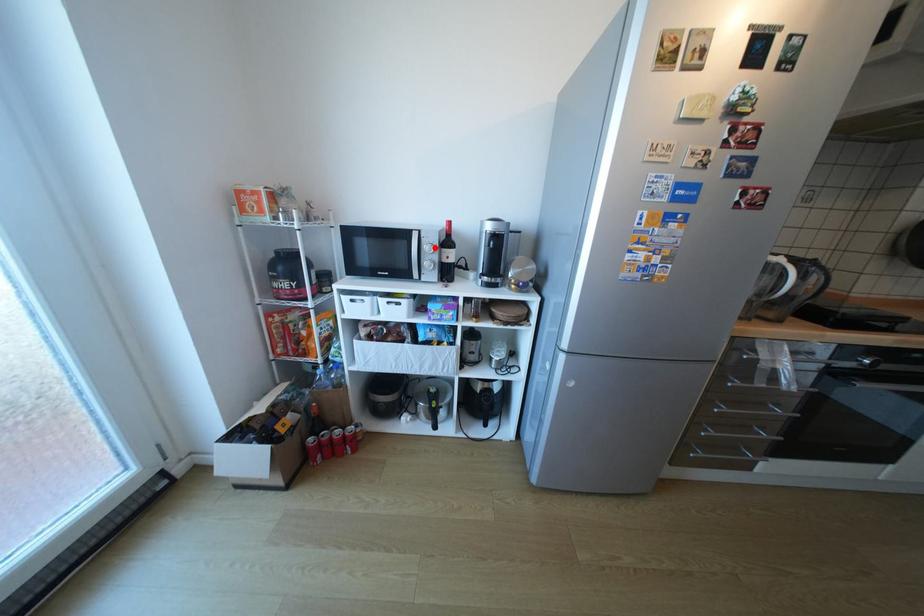
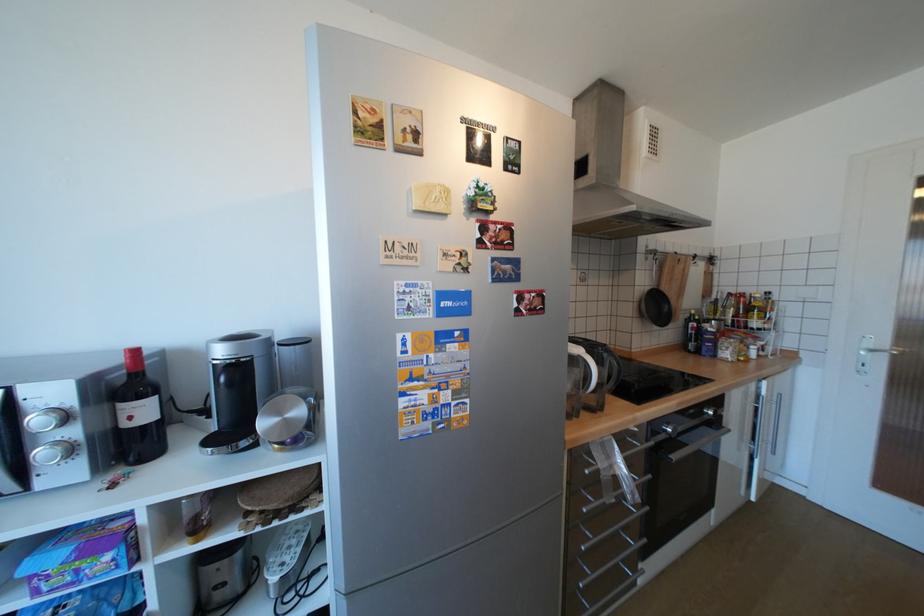
Find the pixel in the second image that matches the highlighted location in the first image.

(46, 419)